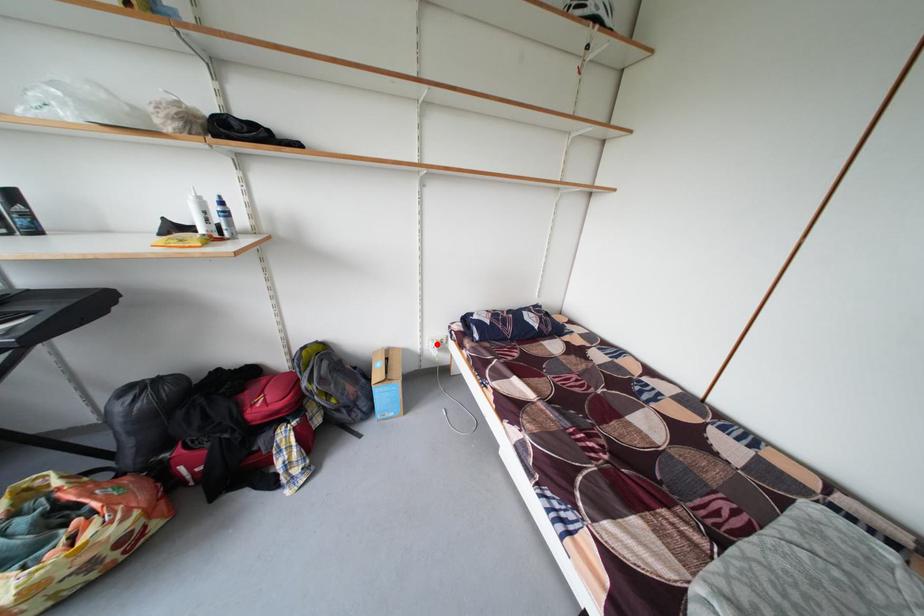
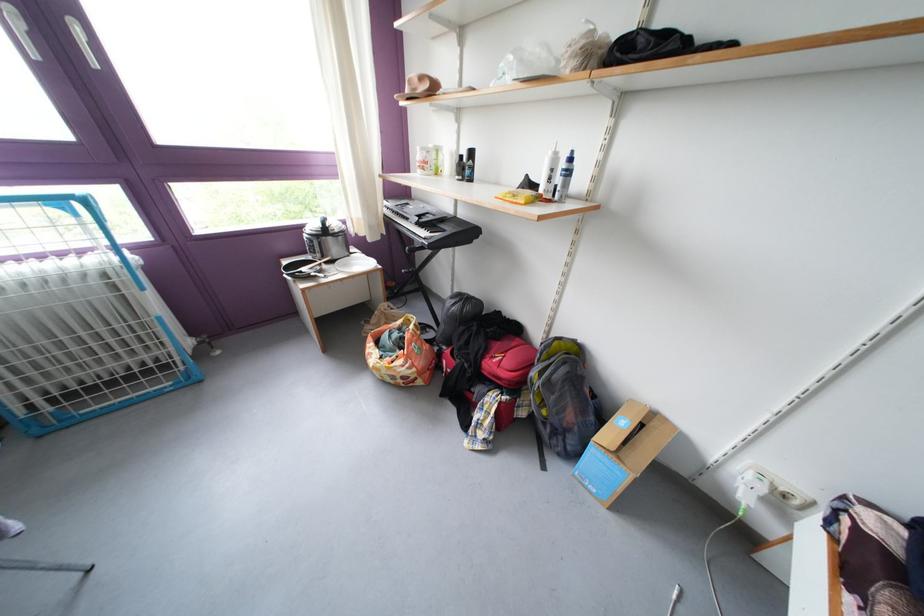
Question: I am providing you with two images of the same scene from different viewpoints. In image1, a red point is highlighted. Considering the same 3D point in image2, which of the following is correct?

Choices:
 (A) It is closer
 (B) It is farther

Answer: (A)